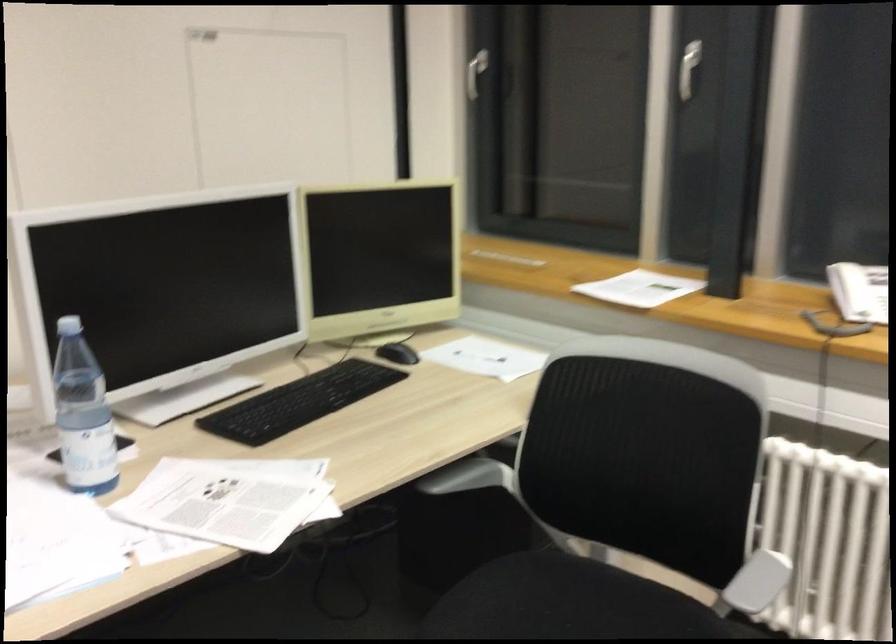
At what (x,y) coordinates should I click in order to perform the action: click on white telephone handset. Please return your answer as a coordinate pair (x, y). This screenshot has height=644, width=896. Looking at the image, I should click on point(850,290).